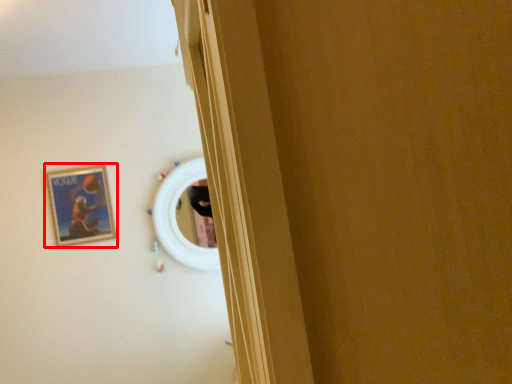
Question: Observing the image, what is the correct spatial positioning of picture frame (annotated by the red box) in reference to mirror?

Choices:
 (A) left
 (B) right

Answer: (A)